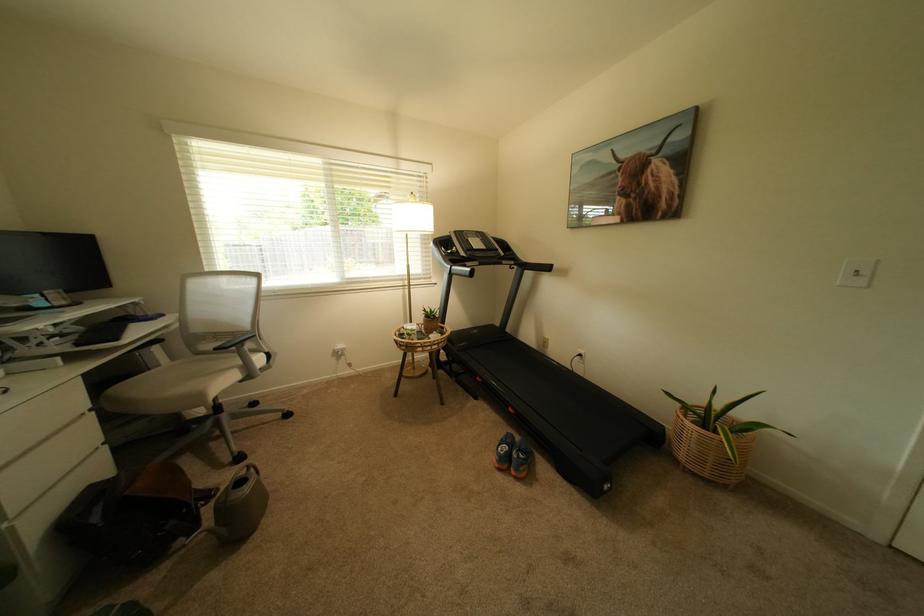
Locate an element on the screen. treadmill handrail is located at coordinates pyautogui.click(x=536, y=265).